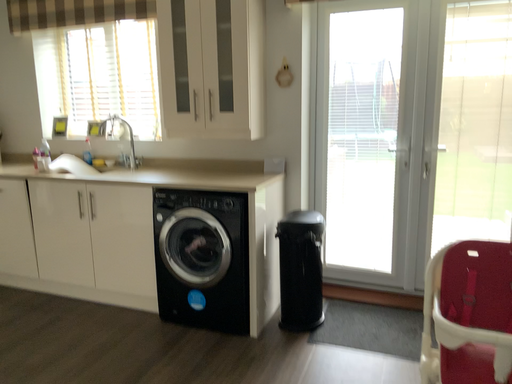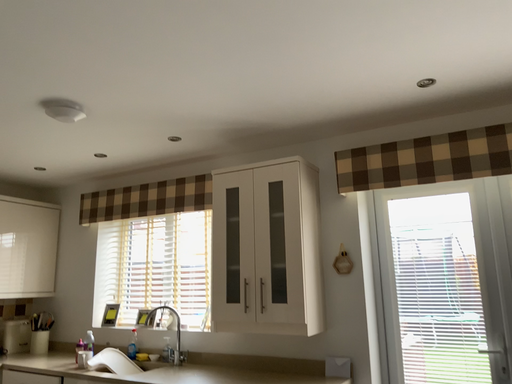
Question: How did the camera likely rotate when shooting the video?

Choices:
 (A) rotated right
 (B) rotated left

Answer: (B)